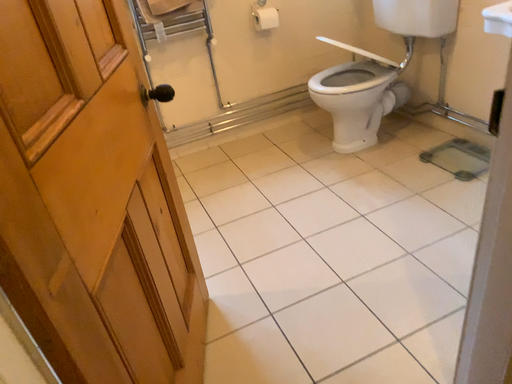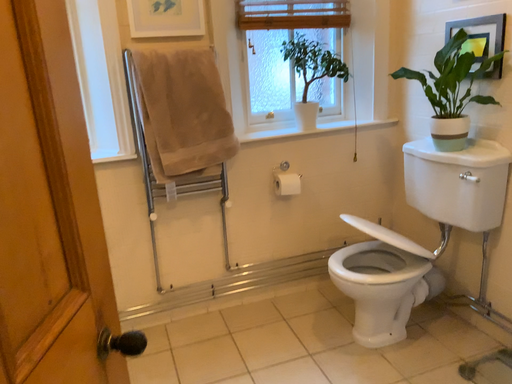
Question: How did the camera likely rotate when shooting the video?

Choices:
 (A) rotated upward
 (B) rotated downward

Answer: (A)